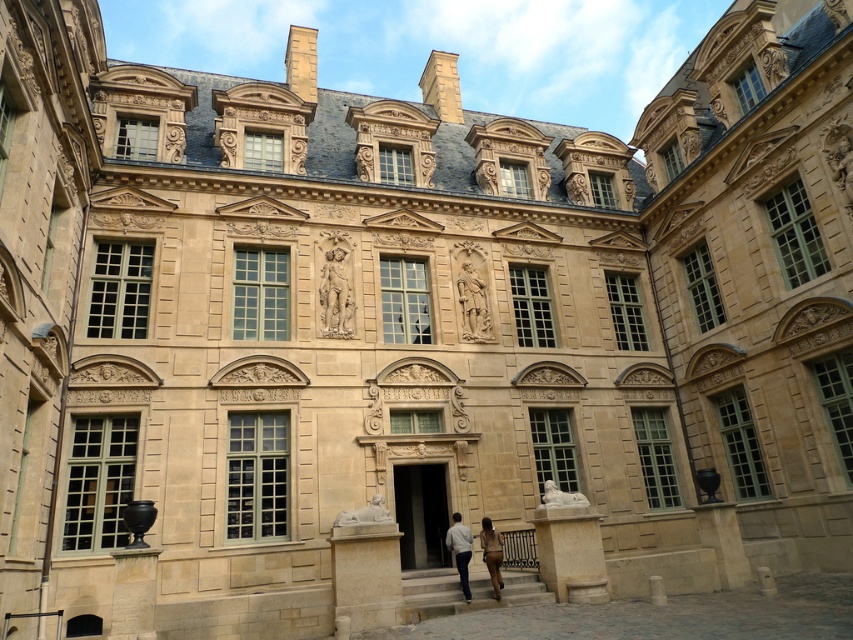
Is white cotton shirt at center further to the viewer compared to brown leather pants at center?

Yes.

Does white cotton shirt at center come in front of brown leather pants at center?

No.

This screenshot has width=853, height=640. In order to click on white cotton shirt at center in this screenshot , I will do `click(460, 550)`.

Find the location of `white cotton shirt at center`. white cotton shirt at center is located at coordinates (460, 550).